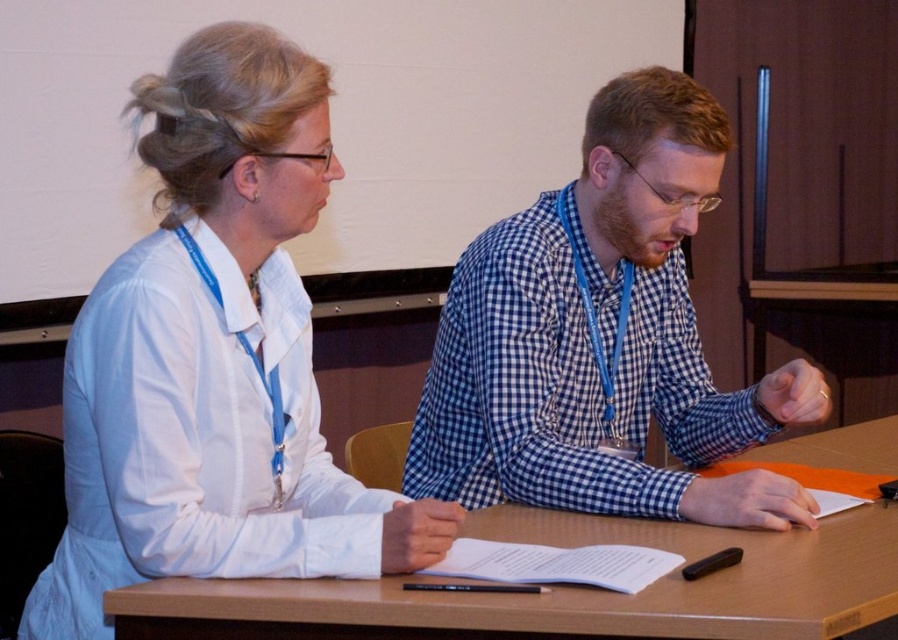
Question: Considering the relative positions of white smooth shirt at upper left and blue checkered shirt at center in the image provided, where is white smooth shirt at upper left located with respect to blue checkered shirt at center?

Choices:
 (A) above
 (B) below

Answer: (B)

Question: Which object is the farthest from the white smooth shirt at upper left?

Choices:
 (A) blue checkered shirt at center
 (B) wooden table at center

Answer: (A)

Question: Does white smooth shirt at upper left have a lesser width compared to wooden table at center?

Choices:
 (A) no
 (B) yes

Answer: (B)

Question: Can you confirm if white smooth shirt at upper left is thinner than wooden table at center?

Choices:
 (A) no
 (B) yes

Answer: (B)

Question: Which object is positioned farthest from the wooden table at center?

Choices:
 (A) white smooth shirt at upper left
 (B) blue checkered shirt at center

Answer: (B)

Question: Which of the following is the farthest from the observer?

Choices:
 (A) blue checkered shirt at center
 (B) white smooth shirt at upper left
 (C) wooden table at center

Answer: (A)